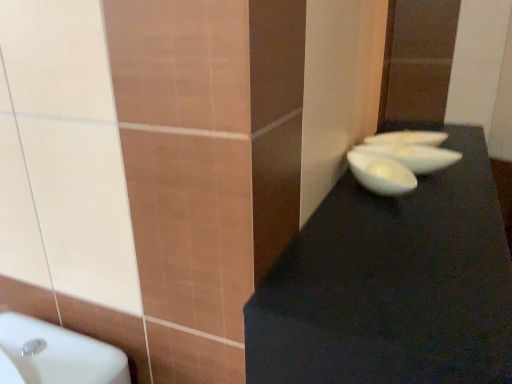
This screenshot has width=512, height=384. In order to click on vacant area that lies in front of white glossy bowl at upper right, the second basin in the front-to-back sequence in this screenshot , I will do `click(458, 175)`.